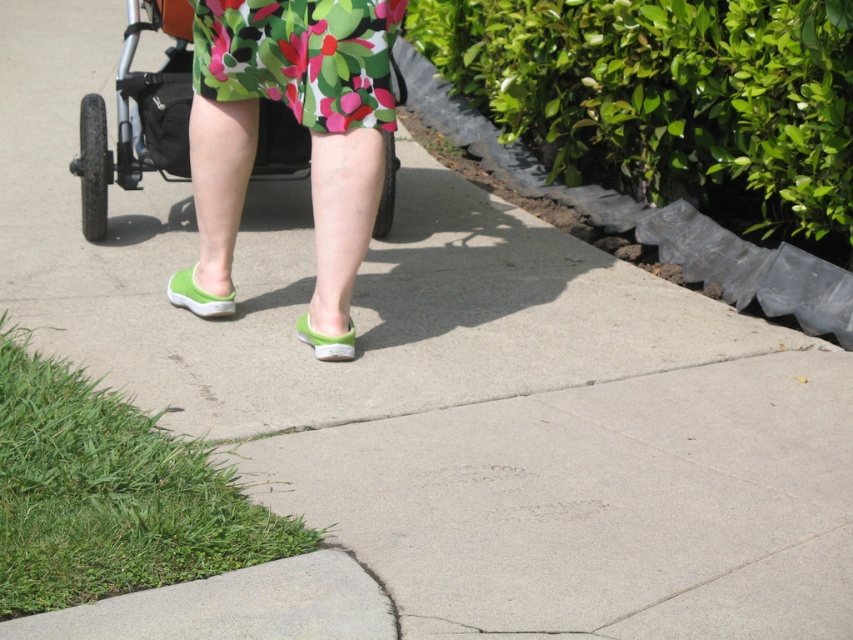
You are a pedestrian standing on the sidewalk. You see the point marked at coordinates (196, 296). What object is located at that point?

The point at (196, 296) corresponds to the green rubber slipper at lower center.

You are a delivery robot that needs to move from the floral fabric dress at center to the stroller on the left side of the frame. The sidewalk is 4 meters wide. Can you safely navigate the path between them?

The distance between the floral fabric dress at center and the stroller on the left side of the frame is 4.40 meters. Since the sidewalk is 4 meters wide, the robot cannot safely navigate the path between them as the required space exceeds the sidewalk width.

You are a delivery drone flying over a sidewalk. You need to land at a specific location. You see two points marked on the sidewalk. Which point is closer to your current position? The points are point 1 at coordinates point (196, 300) and point 2 at coordinates point (316, 339).

Point 1 at coordinates point (196, 300) is closer to your current position because it is further to the viewer than point 2 at coordinates point (316, 339).